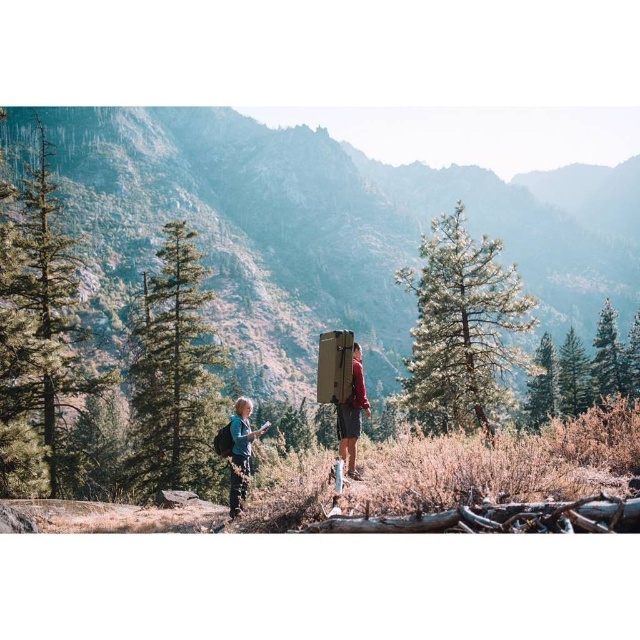
You are a hiker who wants to reach the brown wooden sign at center. The trail you are on is 300 feet long. Do you think you can reach the sign before the trail ends?

The brown wooden sign at center is 304.51 feet from the camera, which is slightly longer than the 300 feet trail. Therefore, you cannot reach the sign before the trail ends.

You are hiking and need to read the brown wooden sign at center. The green matte pine at upper right is blocking your view. Can you step forward to see the sign clearly?

The brown wooden sign at center is further to the viewer than green matte pine at upper right, so stepping forward might bring the sign into clearer view but could also make the pine branch more obstructive. However, since the sign is closer to you, moving closer may help see past the pine.

You are a hiker who wants to read the brown wooden sign at center. You notice a green matte pine at upper right nearby. Will the pine block your view of the sign?

The brown wooden sign at center is taller than the green matte pine at upper right, so the pine will not block your view of the sign.